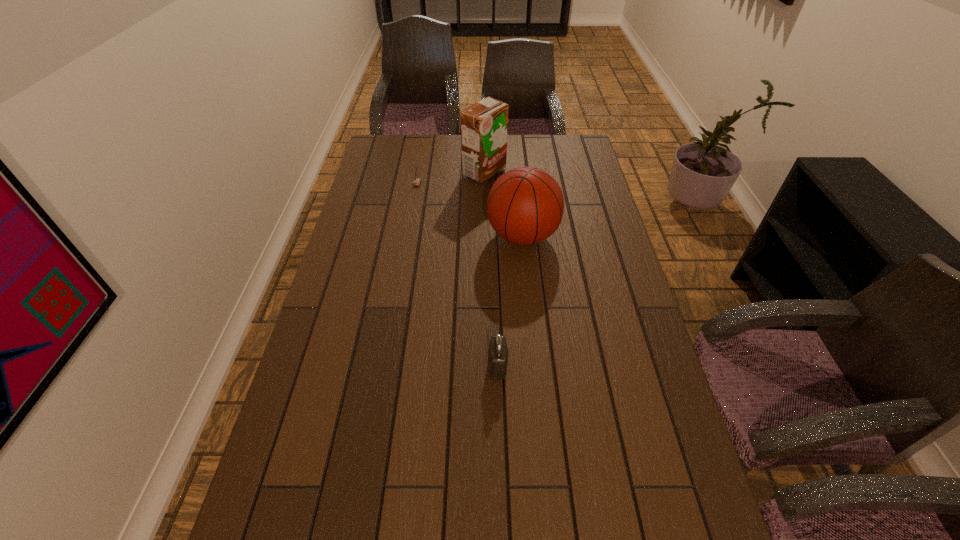
You are a GUI agent. You are given a task and a screenshot of the screen. Output one action in this format:
    pyautogui.click(x=<x>, y=<y>)
    Task: Click on the blank region between the second nearest object and the padlock
    
    Given the screenshot: What is the action you would take?
    click(x=510, y=301)

Where is `free space between the carton and the padlock`? free space between the carton and the padlock is located at coordinates (491, 268).

Locate an element on the screen. Image resolution: width=960 pixels, height=540 pixels. free space between the padlock and the second nearest object is located at coordinates (510, 301).

You are a GUI agent. You are given a task and a screenshot of the screen. Output one action in this format:
    pyautogui.click(x=<x>, y=<y>)
    Task: Click on the object that is the closest to the carton
    This screenshot has width=960, height=540.
    Given the screenshot: What is the action you would take?
    pyautogui.click(x=416, y=181)

Identify which object is the third closest to the carton. Please provide its 2D coordinates. Your answer should be formatted as a tuple, i.e. [(x, y)], where the tuple contains the x and y coordinates of a point satisfying the conditions above.

[(498, 352)]

I want to click on free space that satisfies the following two spatial constraints: 1. on the straw side of the basketball; 2. on the left side of the carton, so click(x=485, y=237).

Where is `free point that satisfies the following two spatial constraints: 1. on the straw side of the carton; 2. on the left side of the third farthest object`? The width and height of the screenshot is (960, 540). free point that satisfies the following two spatial constraints: 1. on the straw side of the carton; 2. on the left side of the third farthest object is located at coordinates (485, 237).

The image size is (960, 540). I want to click on vacant space that satisfies the following two spatial constraints: 1. on the straw side of the carton; 2. on the right side of the basketball, so click(x=485, y=237).